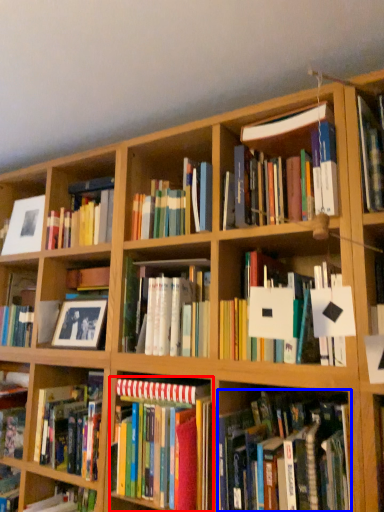
Question: Which point is closer to the camera, book (highlighted by a red box) or book (highlighted by a blue box)?

Choices:
 (A) book
 (B) book

Answer: (B)